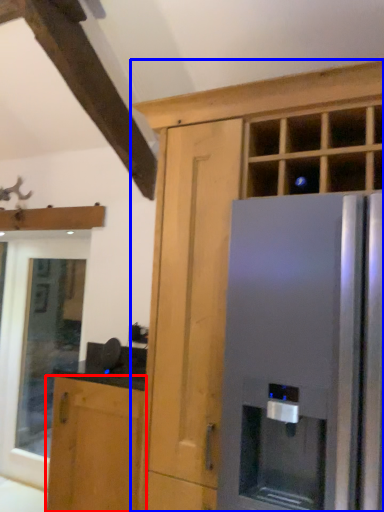
Question: Among these objects, which one is farthest to the camera, cabinetry (highlighted by a red box) or cabinetry (highlighted by a blue box)?

Choices:
 (A) cabinetry
 (B) cabinetry

Answer: (A)